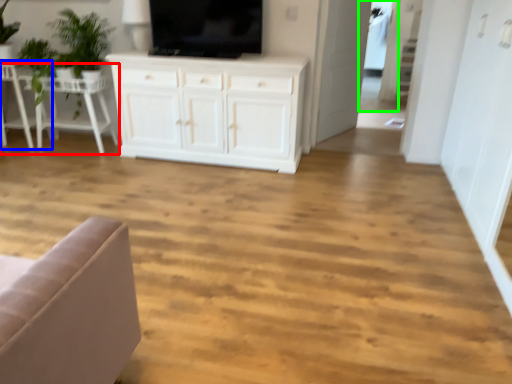
Question: Which object is the farthest from table (highlighted by a red box)? Choose among these: chair (highlighted by a blue box) or glass door (highlighted by a green box).

Choices:
 (A) chair
 (B) glass door

Answer: (B)